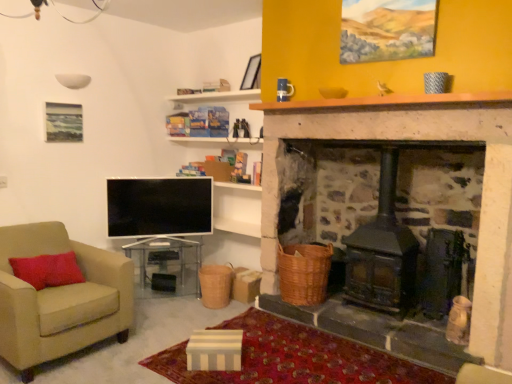
At what (x,y) coordinates should I click in order to perform the action: click on flat screen tv at lower left. Please return your answer as a coordinate pair (x, y). This screenshot has height=384, width=512. Looking at the image, I should click on (159, 206).

Where is `brown wooden mantle at upper center`? This screenshot has height=384, width=512. brown wooden mantle at upper center is located at coordinates (386, 101).

How much space does braided wicker basket at center, which is counted as the second basket, starting from the right, occupy vertically?

braided wicker basket at center, which is counted as the second basket, starting from the right, is 12.49 inches tall.

In order to face clear glass table at center, should I rotate leftwards or rightwards?

You should look left and rotate roughly 12.494 degrees.

This screenshot has height=384, width=512. What do you see at coordinates (251, 72) in the screenshot?
I see `matte black picture frame at upper center` at bounding box center [251, 72].

What do you see at coordinates (303, 273) in the screenshot? I see `woven brown basket at lower center, which is the 1th basket in right-to-left order` at bounding box center [303, 273].

Locate an element on the screen. The image size is (512, 384). flat screen tv at lower left is located at coordinates (159, 206).

Between clear glass table at center and matte black picture frame at upper center, which one appears on the left side from the viewer's perspective?

Positioned to the left is clear glass table at center.

From the image's perspective, between clear glass table at center and matte black picture frame at upper center, who is located below?

clear glass table at center.

Is clear glass table at center further to the viewer compared to matte black picture frame at upper center?

Yes, it is behind matte black picture frame at upper center.

Could you tell me if brown wooden mantle at upper center is facing beige fabric armchair at left?

No, brown wooden mantle at upper center is not oriented towards beige fabric armchair at left.

Measure the distance between brown wooden mantle at upper center and beige fabric armchair at left.

A distance of 1.95 meters exists between brown wooden mantle at upper center and beige fabric armchair at left.

From the image's perspective, would you say brown wooden mantle at upper center is shown under beige fabric armchair at left?

No, from the image's perspective, brown wooden mantle at upper center is not beneath beige fabric armchair at left.

Which object is positioned more to the left, brown wooden mantle at upper center or beige fabric armchair at left?

From the viewer's perspective, beige fabric armchair at left appears more on the left side.

What's the angular difference between woven brown basket at lower center, which is the 1th basket in right-to-left order, and braided wicker basket at center, which is counted as the second basket, starting from the right,'s facing directions?

0.00137 degrees separate the facing orientations of woven brown basket at lower center, which is the 1th basket in right-to-left order, and braided wicker basket at center, which is counted as the second basket, starting from the right.

Can you confirm if woven brown basket at lower center, which is the 1th basket in right-to-left order, is smaller than braided wicker basket at center, which ranks as the 1th basket in left-to-right order?

Incorrect, woven brown basket at lower center, which is the 1th basket in right-to-left order, is not smaller in size than braided wicker basket at center, which ranks as the 1th basket in left-to-right order.

Could you tell me if woven brown basket at lower center, which is the 1th basket in right-to-left order, is turned towards braided wicker basket at center, which ranks as the 1th basket in left-to-right order?

No.

Who is more distant, woven brown basket at lower center, which is the 1th basket in right-to-left order, or braided wicker basket at center, which is counted as the second basket, starting from the right?

braided wicker basket at center, which is counted as the second basket, starting from the right.

I want to click on picture frame above the braided wicker basket at center, which ranks as the 1th basket in left-to-right order (from a real-world perspective), so click(x=251, y=72).

Is braided wicker basket at center, which ranks as the 1th basket in left-to-right order, positioned behind matte black picture frame at upper center?

No, the depth of braided wicker basket at center, which ranks as the 1th basket in left-to-right order, is less than that of matte black picture frame at upper center.

Could you tell me if braided wicker basket at center, which is counted as the second basket, starting from the right, is turned towards matte black picture frame at upper center?

No, braided wicker basket at center, which is counted as the second basket, starting from the right, is not facing towards matte black picture frame at upper center.

Measure the distance from braided wicker basket at center, which ranks as the 1th basket in left-to-right order, to matte black picture frame at upper center.

They are 5.70 feet apart.

Is braided wicker basket at center, which ranks as the 1th basket in left-to-right order, not within woven brown basket at lower center, which is the 2th basket from left to right?

Absolutely, braided wicker basket at center, which ranks as the 1th basket in left-to-right order, is external to woven brown basket at lower center, which is the 2th basket from left to right.

Considering the positions of points (216, 289) and (313, 283), is point (216, 289) closer to camera compared to point (313, 283)?

No, it is behind (313, 283).

Is braided wicker basket at center, which is counted as the second basket, starting from the right, with woven brown basket at lower center, which is the 1th basket in right-to-left order?

braided wicker basket at center, which is counted as the second basket, starting from the right, and woven brown basket at lower center, which is the 1th basket in right-to-left order, are clearly separated.

Considering the positions of objects braided wicker basket at center, which ranks as the 1th basket in left-to-right order, and woven brown basket at lower center, which is the 1th basket in right-to-left order, in the image provided, who is in front, braided wicker basket at center, which ranks as the 1th basket in left-to-right order, or woven brown basket at lower center, which is the 1th basket in right-to-left order,?

woven brown basket at lower center, which is the 1th basket in right-to-left order, is in front.

In the image, is clear glass table at center on the left side or the right side of woven brown basket at lower center, which is the 2th basket from left to right?

Based on their positions, clear glass table at center is located to the left of woven brown basket at lower center, which is the 2th basket from left to right.

Identify the location of basket that is the 2nd one when counting forward from the clear glass table at center. (303, 273).

Which object is thinner, clear glass table at center or woven brown basket at lower center, which is the 2th basket from left to right?

woven brown basket at lower center, which is the 2th basket from left to right.

Does flat screen tv at lower left come behind woven brown basket at lower center, which is the 2th basket from left to right?

Yes, flat screen tv at lower left is further from the viewer.

Considering the points (113, 215) and (311, 270), which point is in front, point (113, 215) or point (311, 270)?

The point (311, 270) is closer.

Based on their sizes in the image, would you say flat screen tv at lower left is bigger or smaller than woven brown basket at lower center, which is the 1th basket in right-to-left order?

In the image, flat screen tv at lower left appears to be smaller than woven brown basket at lower center, which is the 1th basket in right-to-left order.

Is flat screen tv at lower left situated inside woven brown basket at lower center, which is the 1th basket in right-to-left order, or outside?

flat screen tv at lower left is outside woven brown basket at lower center, which is the 1th basket in right-to-left order.

The image size is (512, 384). In order to click on picture frame in front of the clear glass table at center in this screenshot , I will do 251,72.

Locate an element on the screen. chair below the brown wooden mantle at upper center (from the image's perspective) is located at coordinates (60, 299).

Considering their positions, is woven brown basket at lower center, which is the 1th basket in right-to-left order, positioned closer to matte black picture frame at upper center than braided wicker basket at center, which is counted as the second basket, starting from the right?

woven brown basket at lower center, which is the 1th basket in right-to-left order, is positioned closer to the anchor matte black picture frame at upper center.

From the image, which object appears to be farther from flat screen tv at lower left, clear glass table at center or matte black picture frame at upper center?

Based on the image, matte black picture frame at upper center appears to be further to flat screen tv at lower left.

Which object lies nearer to the anchor point matte black picture frame at upper center, beige fabric armchair at left or woven brown basket at lower center, which is the 2th basket from left to right?

The object closer to matte black picture frame at upper center is woven brown basket at lower center, which is the 2th basket from left to right.

Which object lies nearer to the anchor point matte black picture frame at upper center, woven brown basket at lower center, which is the 1th basket in right-to-left order, or flat screen tv at lower left?

flat screen tv at lower left.

Estimate the real-world distances between objects in this image. Which object is closer to braided wicker basket at center, which ranks as the 1th basket in left-to-right order, flat screen tv at lower left or clear glass table at center?

flat screen tv at lower left is closer to braided wicker basket at center, which ranks as the 1th basket in left-to-right order.

When comparing their distances from clear glass table at center, does beige fabric armchair at left or matte black picture frame at upper center seem further?

matte black picture frame at upper center is positioned further to the anchor clear glass table at center.

Looking at this image, estimate the real-world distances between objects in this image. Which object is closer to beige fabric armchair at left, clear glass table at center or matte black picture frame at upper center?

The object closer to beige fabric armchair at left is clear glass table at center.

From the image, which object appears to be farther from flat screen tv at lower left, clear glass table at center or beige fabric armchair at left?

Based on the image, beige fabric armchair at left appears to be further to flat screen tv at lower left.

Find the location of a particular element. This screenshot has width=512, height=384. chair that lies between matte black picture frame at upper center and clear glass table at center from top to bottom is located at coordinates (60, 299).

The width and height of the screenshot is (512, 384). I want to click on mantle between matte black picture frame at upper center and woven brown basket at lower center, which is the 1th basket in right-to-left order, from top to bottom, so click(x=386, y=101).

Where is `television between beige fabric armchair at left and brown wooden mantle at upper center`? This screenshot has height=384, width=512. television between beige fabric armchair at left and brown wooden mantle at upper center is located at coordinates (159, 206).

Where is `table between matte black picture frame at upper center and braided wicker basket at center, which ranks as the 1th basket in left-to-right order, vertically`? The height and width of the screenshot is (384, 512). table between matte black picture frame at upper center and braided wicker basket at center, which ranks as the 1th basket in left-to-right order, vertically is located at coordinates (166, 266).